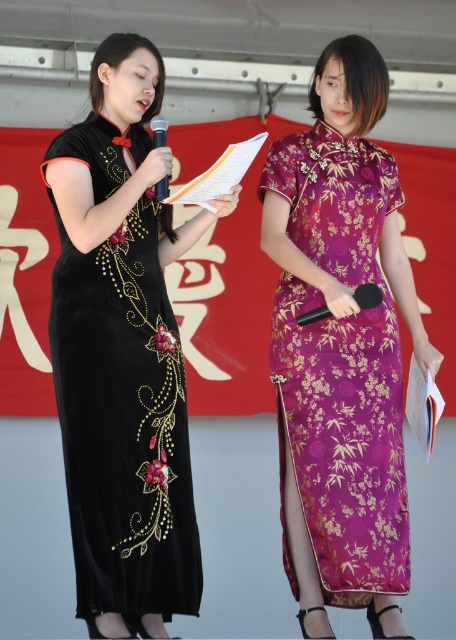
Can you confirm if velvet black dress at left is positioned to the right of black matte microphone at center?

Incorrect, velvet black dress at left is not on the right side of black matte microphone at center.

Between velvet black dress at left and black matte microphone at center, which one appears on the left side from the viewer's perspective?

velvet black dress at left is more to the left.

Between point (182, 563) and point (376, 298), which one is positioned in front?

Positioned in front is point (376, 298).

Find the location of a particular element. This screenshot has height=640, width=456. velvet black dress at left is located at coordinates (124, 422).

Is velvet black dress at left further to camera compared to matte black microphone at center?

No, velvet black dress at left is closer to the viewer.

Which is in front, point (58, 134) or point (165, 144)?

Point (58, 134) is in front.

Who is more distant from viewer, (x=117, y=444) or (x=166, y=195)?

Positioned behind is point (x=166, y=195).

Find the location of a particular element. Image resolution: width=456 pixels, height=640 pixels. velvet black dress at left is located at coordinates (124, 422).

What do you see at coordinates (340, 369) in the screenshot? The height and width of the screenshot is (640, 456). I see `purple silk dress at right` at bounding box center [340, 369].

Can you confirm if purple silk dress at right is thinner than black matte microphone at center?

No.

Between point (362, 500) and point (371, 285), which one is positioned in front?

Point (371, 285) is in front.

Identify the location of purple silk dress at right. This screenshot has height=640, width=456. (340, 369).